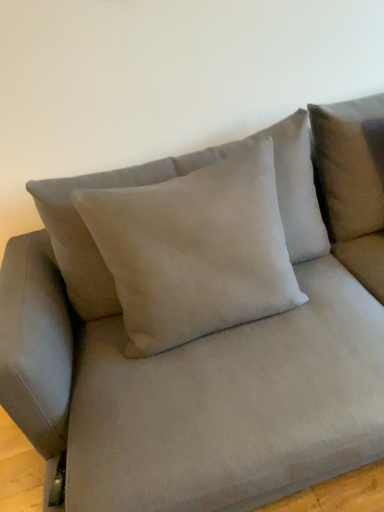
Where is `suede-like beige pillow at center`? This screenshot has width=384, height=512. suede-like beige pillow at center is located at coordinates (195, 250).

The width and height of the screenshot is (384, 512). What do you see at coordinates (195, 250) in the screenshot?
I see `suede-like beige pillow at center` at bounding box center [195, 250].

Identify the location of suede-like beige pillow at center. (195, 250).